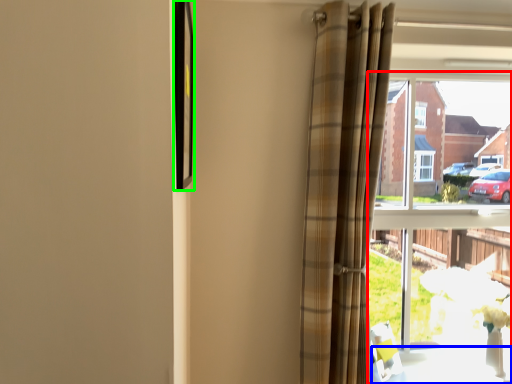
Question: Which object is the farthest from window (highlighted by a red box)? Choose among these: table (highlighted by a blue box) or picture frame (highlighted by a green box).

Choices:
 (A) table
 (B) picture frame

Answer: (B)